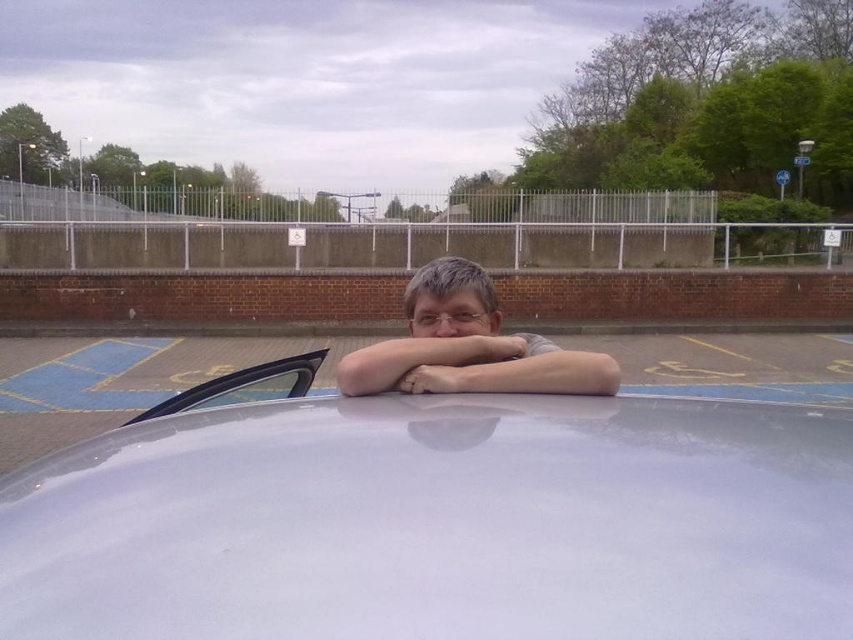
This screenshot has width=853, height=640. What are the coordinates of `white glossy car at center` in the screenshot? It's located at (439, 522).

Which is more to the right, white glossy car at center or transparent glass windshield at upper left?

From the viewer's perspective, white glossy car at center appears more on the right side.

What do you see at coordinates (439, 522) in the screenshot? This screenshot has height=640, width=853. I see `white glossy car at center` at bounding box center [439, 522].

Where is `white glossy car at center`? The width and height of the screenshot is (853, 640). white glossy car at center is located at coordinates (439, 522).

Is white glossy car at center positioned before matte gray shirt at center?

Yes.

At what (x,y) coordinates should I click in order to perform the action: click on white glossy car at center. Please return your answer as a coordinate pair (x, y). Looking at the image, I should click on (439, 522).

Between point (119, 456) and point (566, 364), which one is positioned in front?

Point (119, 456)

I want to click on white glossy car at center, so click(439, 522).

Between point (554, 392) and point (305, 353), which one is positioned behind?

The point (305, 353) is more distant.

Is matte gray shirt at center smaller than transparent glass windshield at upper left?

Incorrect, matte gray shirt at center is not smaller in size than transparent glass windshield at upper left.

What do you see at coordinates (467, 346) in the screenshot? The width and height of the screenshot is (853, 640). I see `matte gray shirt at center` at bounding box center [467, 346].

I want to click on matte gray shirt at center, so click(x=467, y=346).